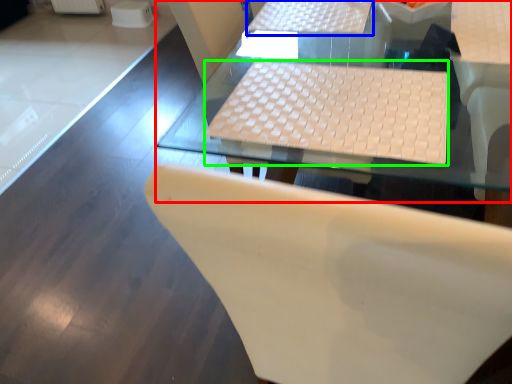
Question: Based on their relative distances, which object is farther from table (highlighted by a red box)? Choose from table (highlighted by a blue box) and laptop keyboard (highlighted by a green box).

Choices:
 (A) table
 (B) laptop keyboard

Answer: (A)